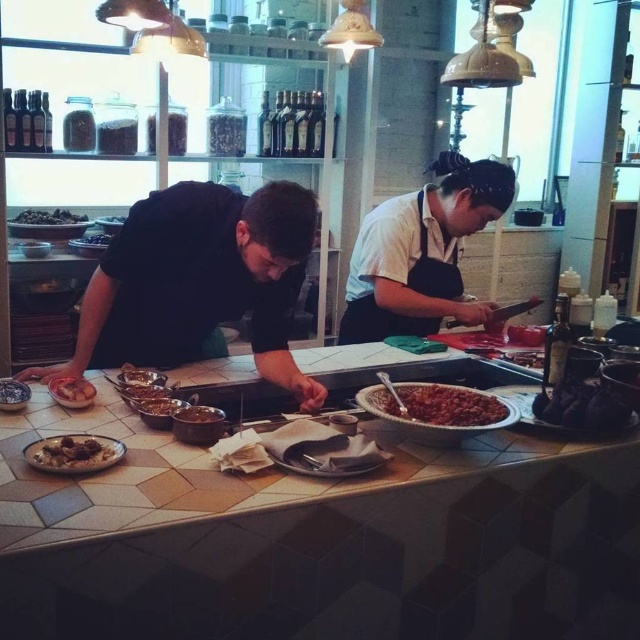
Between point (32, 225) and point (99, 236), which one is positioned in front?

Point (32, 225) is in front.

How much distance is there between dark brown matte olives at left and shiny dark chocolate at center?

dark brown matte olives at left is 15.29 centimeters away from shiny dark chocolate at center.

What do you see at coordinates (49, 218) in the screenshot? Image resolution: width=640 pixels, height=640 pixels. I see `dark brown matte olives at left` at bounding box center [49, 218].

Locate an element on the screen. The width and height of the screenshot is (640, 640). dark brown matte olives at left is located at coordinates tap(49, 218).

Is white tile table at center positioned behind shiny silver bowl at center?

No, white tile table at center is in front of shiny silver bowl at center.

Locate an element on the screen. white tile table at center is located at coordinates 321,541.

Is white matte apron at center taller than brown matte bread at left?

Yes.

Can you confirm if white matte apron at center is smaller than brown matte bread at left?

Incorrect, white matte apron at center is not smaller in size than brown matte bread at left.

Does point (454, 259) lie behind point (84, 381)?

That is True.

Locate an element on the screen. The height and width of the screenshot is (640, 640). white matte apron at center is located at coordinates (420, 252).